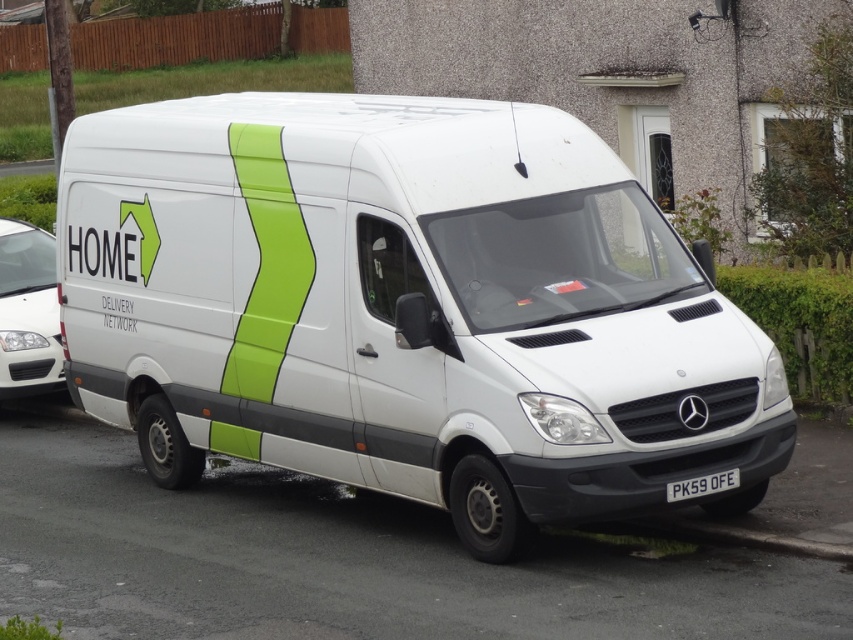
Based on the photo, you are a delivery driver who needs to park your van exactly at the center of the residential street. The white matte van at center is currently parked at point 0.477 on the coordinate system. Is the van already parked at the correct position?

The white matte van at center is located at point 0.477, which is very close to the center. Depending on the required precision, it might be considered correctly parked, but technically it is slightly off the exact center point 0.5.

You are a delivery person who needs to attach a magnetic sign to the side of the vehicle. The sign is 1.2 meters wide. Considering the white glossy car at left and the white plastic license plate at lower center, which object can the sign be safely attached to without overlapping?

The white glossy car at left has a larger size compared to the white plastic license plate at lower center, so the sign can be safely attached to the white glossy car at left without overlapping.